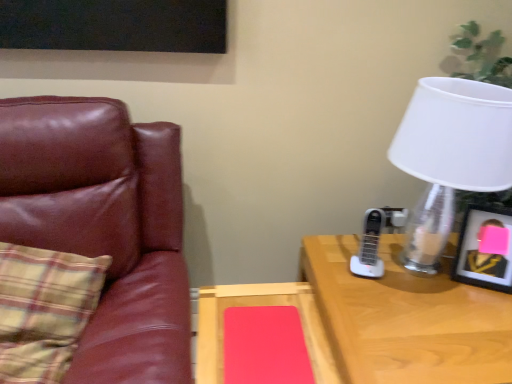
Find the location of a particular element. vacant space underneath white matte lampshade at upper right (from a real-world perspective) is located at coordinates (415, 273).